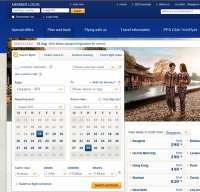
You are a GUI agent. You are given a task and a screenshot of the screen. Output one action in this format:
    pyautogui.click(x=<x>, y=<y>)
    Task: Click on the calendars
    The image size is (200, 192).
    Given the screenshot: What is the action you would take?
    pyautogui.click(x=36, y=124), pyautogui.click(x=84, y=126)